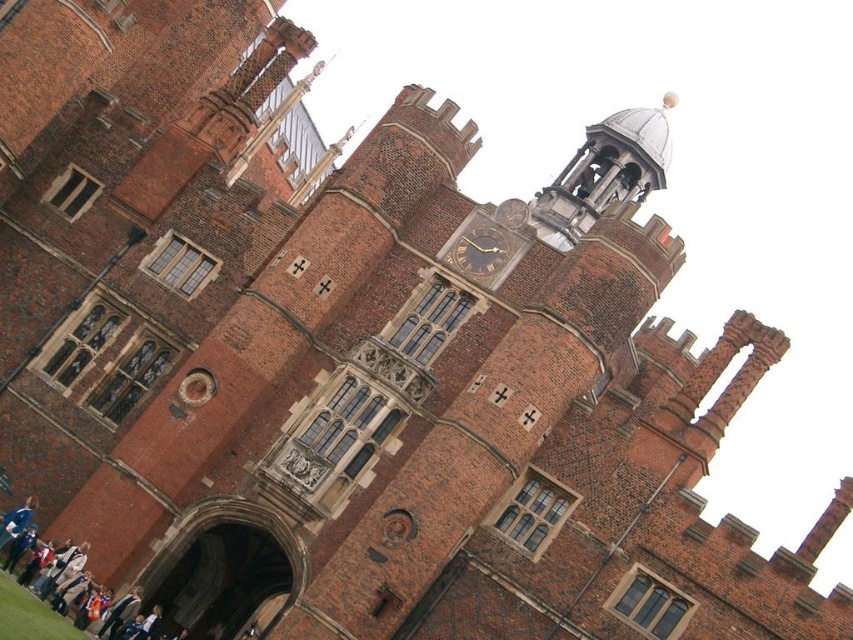
You are a photographer standing in front of the historic building. You want to take a photo that includes both the white cotton shirt at lower left and the gold metallic clock at upper center. Which object should you zoom in on to ensure both are clearly visible in the frame?

The white cotton shirt at lower left is bigger than the gold metallic clock at upper center. To ensure both are clearly visible, you should zoom in on the smaller object, the gold metallic clock at upper center, so the larger shirt at lower left doesn

You are a tailor who needs to place a gold metallic clock at upper center onto a white cotton shirt at lower left. Can the clock fit on the shirt without overlapping the edges?

The white cotton shirt at lower left might be wider than gold metallic clock at upper center, so there is a possibility that the clock can fit on the shirt without overlapping the edges. However, the exact dimensions are uncertain based on the provided information.

You are standing in front of the historic building and notice two items of interest. The first is the white cotton shirt at lower left, and the second is the gold metallic clock at upper center. Which of these two items is taller?

The white cotton shirt at lower left is taller than the gold metallic clock at upper center according to the description.